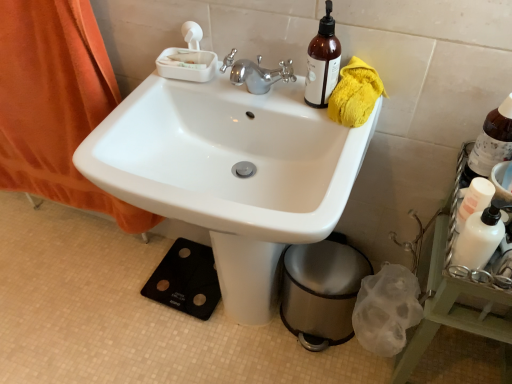
Where is `free space to the left of white glossy sink at center`? This screenshot has width=512, height=384. free space to the left of white glossy sink at center is located at coordinates (98, 321).